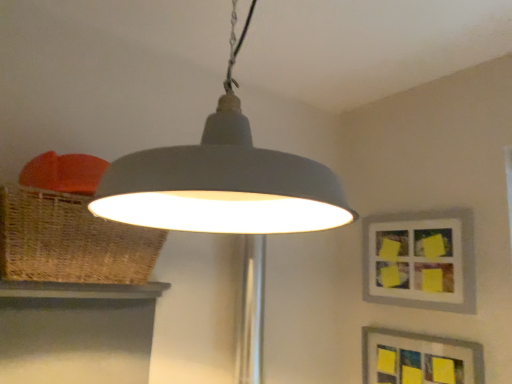
Question: Is point (412, 215) closer or farther from the camera than point (480, 364)?

Choices:
 (A) closer
 (B) farther

Answer: (B)

Question: Is matte gray picture frame at upper right, marked as the 2th picture frame in a bottom-to-top arrangement, to the left or to the right of matte gray picture frame at lower right, the 1th picture frame positioned from the bottom, in the image?

Choices:
 (A) left
 (B) right

Answer: (B)

Question: Which object is positioned farthest from the matte gray lampshade at center?

Choices:
 (A) matte gray picture frame at upper right, the 1th picture frame viewed from the top
 (B) woven brown basket at left
 (C) matte gray picture frame at lower right, which is counted as the second picture frame, starting from the top

Answer: (C)

Question: Which of these objects is positioned farthest from the matte gray lampshade at center?

Choices:
 (A) matte gray picture frame at lower right, the 1th picture frame positioned from the bottom
 (B) matte gray picture frame at upper right, the 1th picture frame viewed from the top
 (C) woven brown basket at left

Answer: (A)